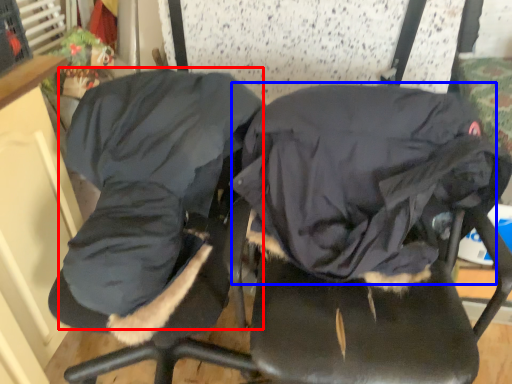
Question: Among these objects, which one is farthest to the camera, clothing (highlighted by a red box) or sleeping bag (highlighted by a blue box)?

Choices:
 (A) clothing
 (B) sleeping bag

Answer: (B)